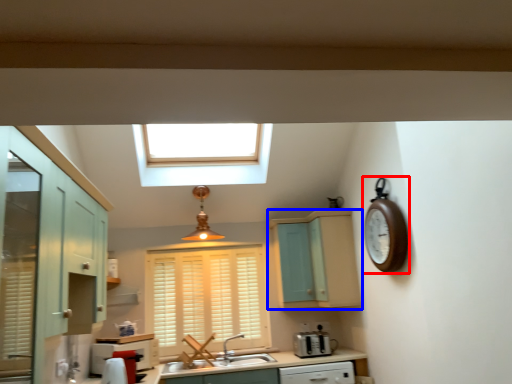
Question: Which object appears farthest to the camera in this image, clock (highlighted by a red box) or cabinetry (highlighted by a blue box)?

Choices:
 (A) clock
 (B) cabinetry

Answer: (B)